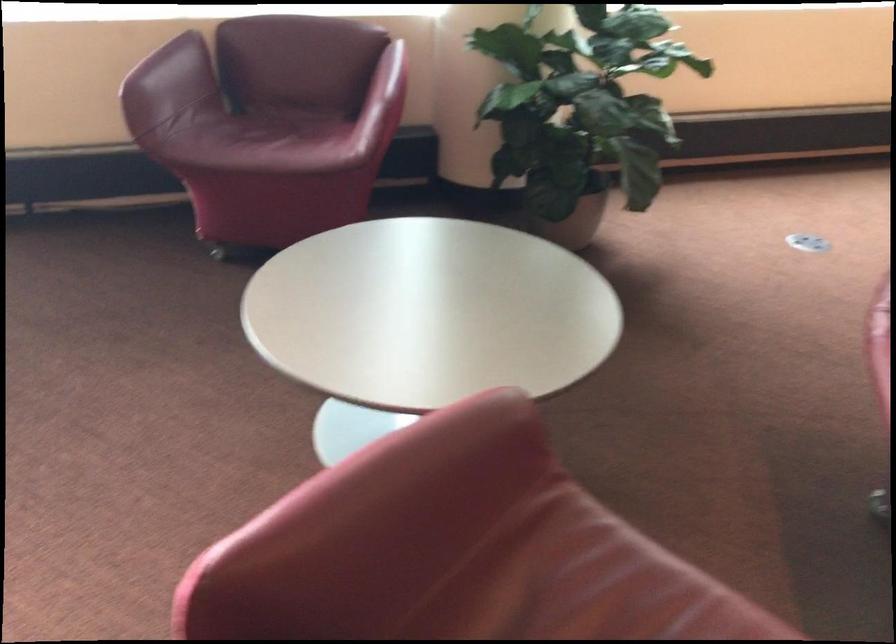
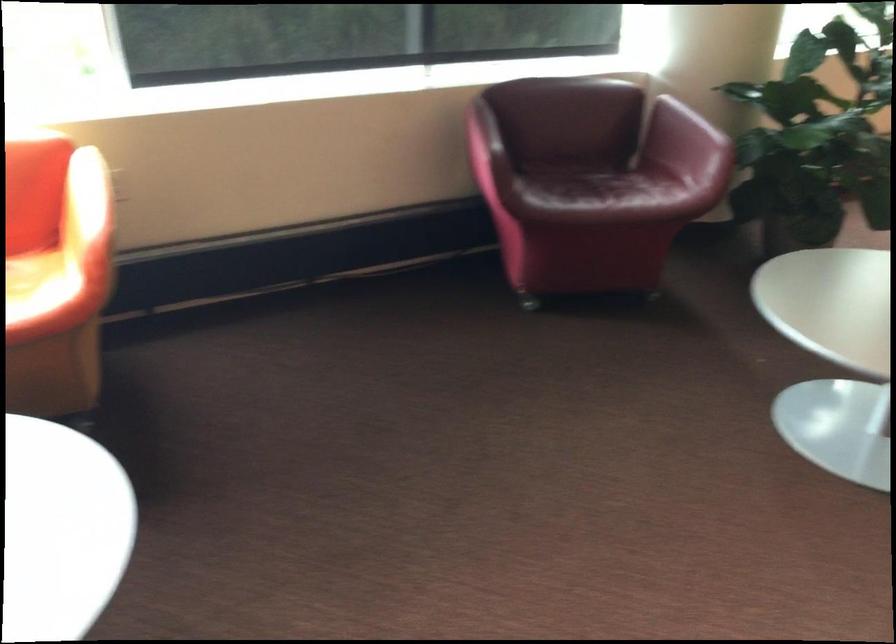
Find the pixel in the second image that matches (165,57) in the first image.

(469, 114)